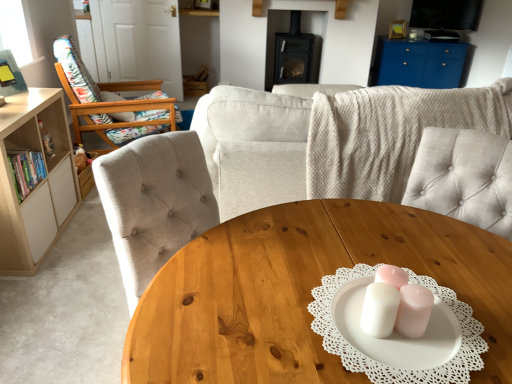
Question: Does light beige wood bookshelf at left appear on the left side of beige fabric couch at center?

Choices:
 (A) no
 (B) yes

Answer: (B)

Question: Can you confirm if light beige wood bookshelf at left is positioned to the right of beige fabric couch at center?

Choices:
 (A) no
 (B) yes

Answer: (A)

Question: Is light beige wood bookshelf at left turned away from beige fabric couch at center?

Choices:
 (A) no
 (B) yes

Answer: (A)

Question: Does light beige wood bookshelf at left have a smaller size compared to beige fabric couch at center?

Choices:
 (A) no
 (B) yes

Answer: (B)

Question: Can you confirm if light beige wood bookshelf at left is thinner than beige fabric couch at center?

Choices:
 (A) yes
 (B) no

Answer: (A)

Question: Is blue glossy cabinet at upper right in front of or behind wooden floral-patterned chair at left in the image?

Choices:
 (A) front
 (B) behind

Answer: (B)

Question: In terms of width, does blue glossy cabinet at upper right look wider or thinner when compared to wooden floral-patterned chair at left?

Choices:
 (A) wide
 (B) thin

Answer: (B)

Question: From a real-world perspective, is blue glossy cabinet at upper right positioned above or below wooden floral-patterned chair at left?

Choices:
 (A) below
 (B) above

Answer: (A)

Question: From the image's perspective, is blue glossy cabinet at upper right located above or below wooden floral-patterned chair at left?

Choices:
 (A) above
 (B) below

Answer: (A)

Question: In the image, is light beige wood bookshelf at left positioned in front of or behind wooden coffee table at center?

Choices:
 (A) front
 (B) behind

Answer: (B)

Question: Is point click(x=2, y=213) positioned closer to the camera than point click(x=307, y=264)?

Choices:
 (A) farther
 (B) closer

Answer: (A)

Question: Is light beige wood bookshelf at left inside or outside of wooden coffee table at center?

Choices:
 (A) outside
 (B) inside

Answer: (A)

Question: From the image's perspective, relative to wooden coffee table at center, is light beige wood bookshelf at left above or below?

Choices:
 (A) above
 (B) below

Answer: (A)

Question: Considering the positions of point (154, 122) and point (408, 46), is point (154, 122) closer or farther from the camera than point (408, 46)?

Choices:
 (A) closer
 (B) farther

Answer: (A)

Question: From a real-world perspective, is wooden floral-patterned chair at left physically located above or below blue glossy cabinet at upper right?

Choices:
 (A) below
 (B) above

Answer: (B)